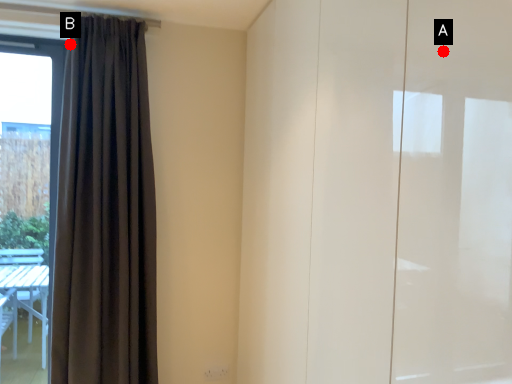
Question: Two points are circled on the image, labeled by A and B beside each circle. Which of the following is the closest to the observer?

Choices:
 (A) A is closer
 (B) B is closer

Answer: (A)